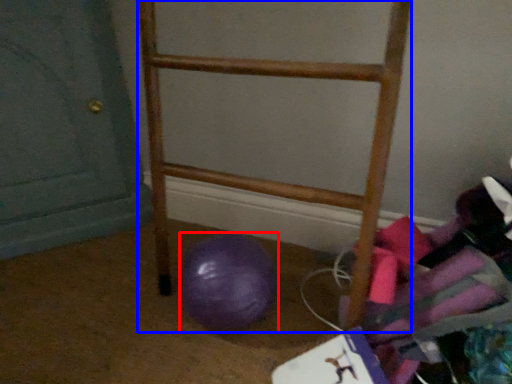
Question: Which object appears farthest to the camera in this image, ball (highlighted by a red box) or furniture (highlighted by a blue box)?

Choices:
 (A) ball
 (B) furniture

Answer: (A)